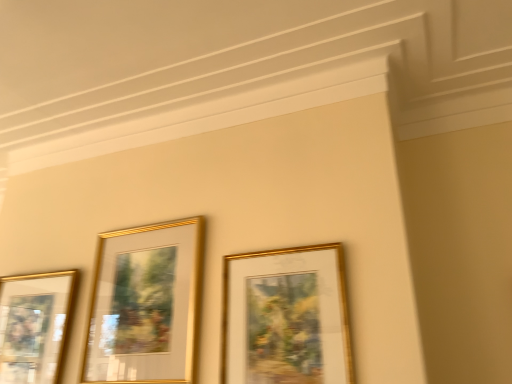
At what (x,y) coordinates should I click in order to perform the action: click on gold metallic picture frame at left, which ranks as the 1th picture frame in left-to-right order. Please return your answer as a coordinate pair (x, y). This screenshot has height=384, width=512. Looking at the image, I should click on (34, 325).

Where is `gold metallic picture frame at left, arranged as the third picture frame when viewed from the right`? The width and height of the screenshot is (512, 384). gold metallic picture frame at left, arranged as the third picture frame when viewed from the right is located at coordinates (34, 325).

From the image's perspective, is gold/glossy picture frame at center, the 2th picture frame viewed from the left, located above gold/glossy picture frame at center, the first picture frame in the right-to-left sequence?

No, from the image's perspective, gold/glossy picture frame at center, the 2th picture frame viewed from the left, is not over gold/glossy picture frame at center, the first picture frame in the right-to-left sequence.

Could you tell me if gold/glossy picture frame at center, which is the 2th picture frame from right to left, is facing gold/glossy picture frame at center, acting as the third picture frame starting from the left?

No, gold/glossy picture frame at center, which is the 2th picture frame from right to left, does not turn towards gold/glossy picture frame at center, acting as the third picture frame starting from the left.

Considering the relative positions of gold/glossy picture frame at center, the 2th picture frame viewed from the left, and gold/glossy picture frame at center, acting as the third picture frame starting from the left, in the image provided, is gold/glossy picture frame at center, the 2th picture frame viewed from the left, in front of gold/glossy picture frame at center, acting as the third picture frame starting from the left,?

No, gold/glossy picture frame at center, the 2th picture frame viewed from the left, is further to the viewer.

Is gold/glossy picture frame at center, which is the 2th picture frame from right to left, shorter than gold/glossy picture frame at center, the first picture frame in the right-to-left sequence?

No.

Is gold metallic picture frame at left, which ranks as the 1th picture frame in left-to-right order, inside gold/glossy picture frame at center, the 2th picture frame viewed from the left?

No, gold metallic picture frame at left, which ranks as the 1th picture frame in left-to-right order, is located outside of gold/glossy picture frame at center, the 2th picture frame viewed from the left.

From a real-world perspective, is gold/glossy picture frame at center, the 2th picture frame viewed from the left, physically located above or below gold metallic picture frame at left, which ranks as the 1th picture frame in left-to-right order?

gold/glossy picture frame at center, the 2th picture frame viewed from the left, is situated higher than gold metallic picture frame at left, which ranks as the 1th picture frame in left-to-right order, in the real world.

Is gold/glossy picture frame at center, which is the 2th picture frame from right to left, facing away from gold metallic picture frame at left, which ranks as the 1th picture frame in left-to-right order?

No, gold/glossy picture frame at center, which is the 2th picture frame from right to left, is not facing away from gold metallic picture frame at left, which ranks as the 1th picture frame in left-to-right order.

Is gold/glossy picture frame at center, acting as the third picture frame starting from the left, smaller than gold/glossy picture frame at center, which is the 2th picture frame from right to left?

Yes, gold/glossy picture frame at center, acting as the third picture frame starting from the left, is smaller than gold/glossy picture frame at center, which is the 2th picture frame from right to left.

Looking at this image, measure the distance between gold/glossy picture frame at center, the first picture frame in the right-to-left sequence, and gold/glossy picture frame at center, the 2th picture frame viewed from the left.

gold/glossy picture frame at center, the first picture frame in the right-to-left sequence, is 12.33 inches from gold/glossy picture frame at center, the 2th picture frame viewed from the left.

Consider the image. Is gold/glossy picture frame at center, acting as the third picture frame starting from the left, in front of or behind gold/glossy picture frame at center, the 2th picture frame viewed from the left, in the image?

In the image, gold/glossy picture frame at center, acting as the third picture frame starting from the left, appears in front of gold/glossy picture frame at center, the 2th picture frame viewed from the left.

Could you tell me if gold/glossy picture frame at center, the first picture frame in the right-to-left sequence, is facing gold/glossy picture frame at center, which is the 2th picture frame from right to left?

No, gold/glossy picture frame at center, the first picture frame in the right-to-left sequence, does not turn towards gold/glossy picture frame at center, which is the 2th picture frame from right to left.

From a real-world perspective, which is physically above, gold metallic picture frame at left, arranged as the third picture frame when viewed from the right, or gold/glossy picture frame at center, which is the 2th picture frame from right to left?

From a 3D spatial view, gold/glossy picture frame at center, which is the 2th picture frame from right to left, is above.

This screenshot has height=384, width=512. What are the coordinates of `the 1st picture frame to the right of the gold metallic picture frame at left, which ranks as the 1th picture frame in left-to-right order, starting your count from the anchor` in the screenshot? It's located at (145, 304).

Who is shorter, gold metallic picture frame at left, arranged as the third picture frame when viewed from the right, or gold/glossy picture frame at center, which is the 2th picture frame from right to left?

gold metallic picture frame at left, arranged as the third picture frame when viewed from the right.

Is gold metallic picture frame at left, which ranks as the 1th picture frame in left-to-right order, bigger or smaller than gold/glossy picture frame at center, which is the 2th picture frame from right to left?

Considering their sizes, gold metallic picture frame at left, which ranks as the 1th picture frame in left-to-right order, takes up more space than gold/glossy picture frame at center, which is the 2th picture frame from right to left.

From the picture: Who is shorter, gold/glossy picture frame at center, acting as the third picture frame starting from the left, or gold metallic picture frame at left, arranged as the third picture frame when viewed from the right?

Standing shorter between the two is gold/glossy picture frame at center, acting as the third picture frame starting from the left.

What's the angular difference between gold/glossy picture frame at center, the first picture frame in the right-to-left sequence, and gold metallic picture frame at left, arranged as the third picture frame when viewed from the right,'s facing directions?

gold/glossy picture frame at center, the first picture frame in the right-to-left sequence, and gold metallic picture frame at left, arranged as the third picture frame when viewed from the right, are facing 0.00466 degrees away from each other.

Which object is wider, gold/glossy picture frame at center, acting as the third picture frame starting from the left, or gold metallic picture frame at left, arranged as the third picture frame when viewed from the right?

With larger width is gold metallic picture frame at left, arranged as the third picture frame when viewed from the right.

Is gold/glossy picture frame at center, acting as the third picture frame starting from the left, looking in the opposite direction of gold metallic picture frame at left, arranged as the third picture frame when viewed from the right?

gold/glossy picture frame at center, acting as the third picture frame starting from the left, is not turned away from gold metallic picture frame at left, arranged as the third picture frame when viewed from the right.

Measure the distance from gold metallic picture frame at left, which ranks as the 1th picture frame in left-to-right order, to gold/glossy picture frame at center, the first picture frame in the right-to-left sequence.

A distance of 32.07 inches exists between gold metallic picture frame at left, which ranks as the 1th picture frame in left-to-right order, and gold/glossy picture frame at center, the first picture frame in the right-to-left sequence.

Consider the image. Between gold metallic picture frame at left, which ranks as the 1th picture frame in left-to-right order, and gold/glossy picture frame at center, acting as the third picture frame starting from the left, which one appears on the right side from the viewer's perspective?

gold/glossy picture frame at center, acting as the third picture frame starting from the left.

From the image's perspective, which is above, gold metallic picture frame at left, arranged as the third picture frame when viewed from the right, or gold/glossy picture frame at center, acting as the third picture frame starting from the left?

gold/glossy picture frame at center, acting as the third picture frame starting from the left, from the image's perspective.

This screenshot has width=512, height=384. Identify the location of picture frame that is the 1st one when counting leftward from the gold/glossy picture frame at center, the first picture frame in the right-to-left sequence. pos(145,304).

This screenshot has height=384, width=512. I want to click on the 2nd picture frame positioned below the gold/glossy picture frame at center, the 2th picture frame viewed from the left (from a real-world perspective), so click(34, 325).

Based on their spatial positions, is gold metallic picture frame at left, which ranks as the 1th picture frame in left-to-right order, or gold/glossy picture frame at center, the 2th picture frame viewed from the left, closer to gold/glossy picture frame at center, acting as the third picture frame starting from the left?

Based on the image, gold/glossy picture frame at center, the 2th picture frame viewed from the left, appears to be nearer to gold/glossy picture frame at center, acting as the third picture frame starting from the left.

Which object lies further to the anchor point gold metallic picture frame at left, arranged as the third picture frame when viewed from the right, gold/glossy picture frame at center, acting as the third picture frame starting from the left, or gold/glossy picture frame at center, which is the 2th picture frame from right to left?

gold/glossy picture frame at center, acting as the third picture frame starting from the left.

Based on their spatial positions, is gold metallic picture frame at left, arranged as the third picture frame when viewed from the right, or gold/glossy picture frame at center, the first picture frame in the right-to-left sequence, further from gold/glossy picture frame at center, the 2th picture frame viewed from the left?

Based on the image, gold/glossy picture frame at center, the first picture frame in the right-to-left sequence, appears to be further to gold/glossy picture frame at center, the 2th picture frame viewed from the left.

When comparing their distances from gold/glossy picture frame at center, the first picture frame in the right-to-left sequence, does gold/glossy picture frame at center, the 2th picture frame viewed from the left, or gold metallic picture frame at left, which ranks as the 1th picture frame in left-to-right order, seem closer?

gold/glossy picture frame at center, the 2th picture frame viewed from the left, is positioned closer to the anchor gold/glossy picture frame at center, the first picture frame in the right-to-left sequence.

Considering their positions, is gold/glossy picture frame at center, the first picture frame in the right-to-left sequence, positioned further to gold/glossy picture frame at center, which is the 2th picture frame from right to left, than gold metallic picture frame at left, which ranks as the 1th picture frame in left-to-right order?

gold/glossy picture frame at center, the first picture frame in the right-to-left sequence, lies further to gold/glossy picture frame at center, which is the 2th picture frame from right to left, than the other object.

In the scene shown: Which object lies nearer to the anchor point gold metallic picture frame at left, arranged as the third picture frame when viewed from the right, gold/glossy picture frame at center, which is the 2th picture frame from right to left, or gold/glossy picture frame at center, acting as the third picture frame starting from the left?

Among the two, gold/glossy picture frame at center, which is the 2th picture frame from right to left, is located nearer to gold metallic picture frame at left, arranged as the third picture frame when viewed from the right.

Where is `picture frame situated between gold metallic picture frame at left, which ranks as the 1th picture frame in left-to-right order, and gold/glossy picture frame at center, acting as the third picture frame starting from the left, from left to right`? picture frame situated between gold metallic picture frame at left, which ranks as the 1th picture frame in left-to-right order, and gold/glossy picture frame at center, acting as the third picture frame starting from the left, from left to right is located at coordinates (145, 304).